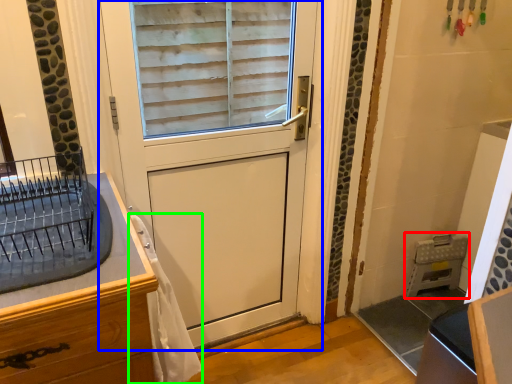
Question: Which object is positioned closest to appliance (highlighted by a red box)? Select from door (highlighted by a blue box) and material (highlighted by a green box).

Choices:
 (A) door
 (B) material

Answer: (A)